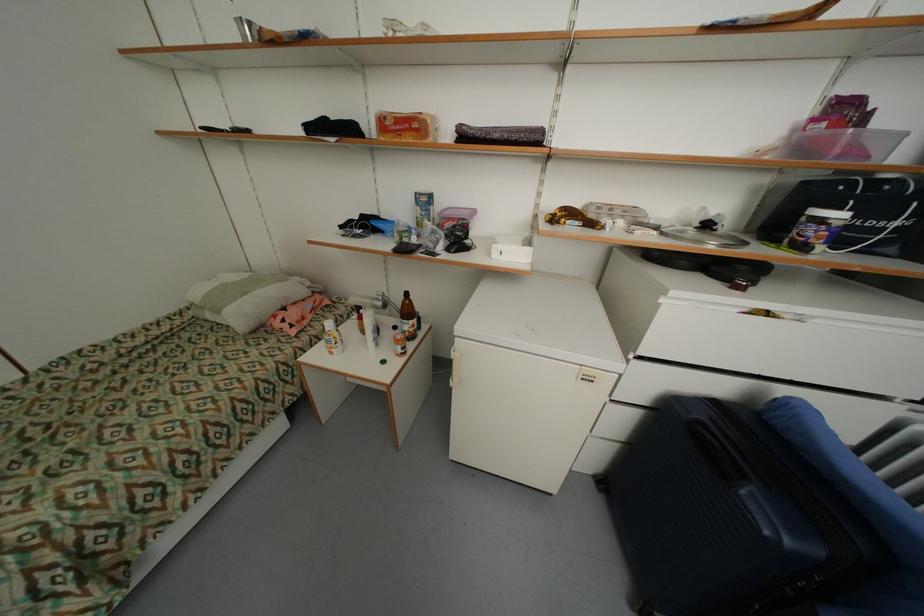
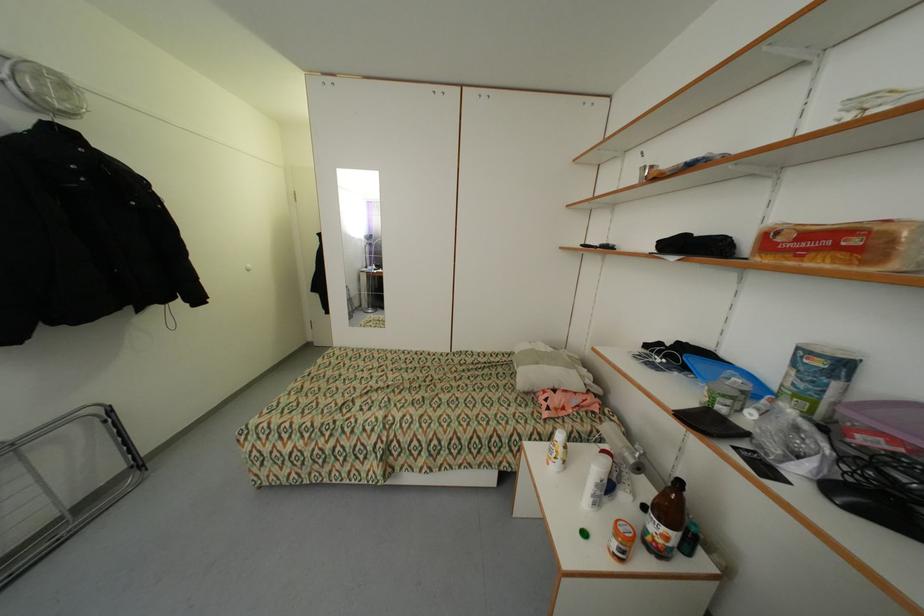
The point at (409, 349) is marked in the first image. Where is the corresponding point in the second image?

(627, 552)